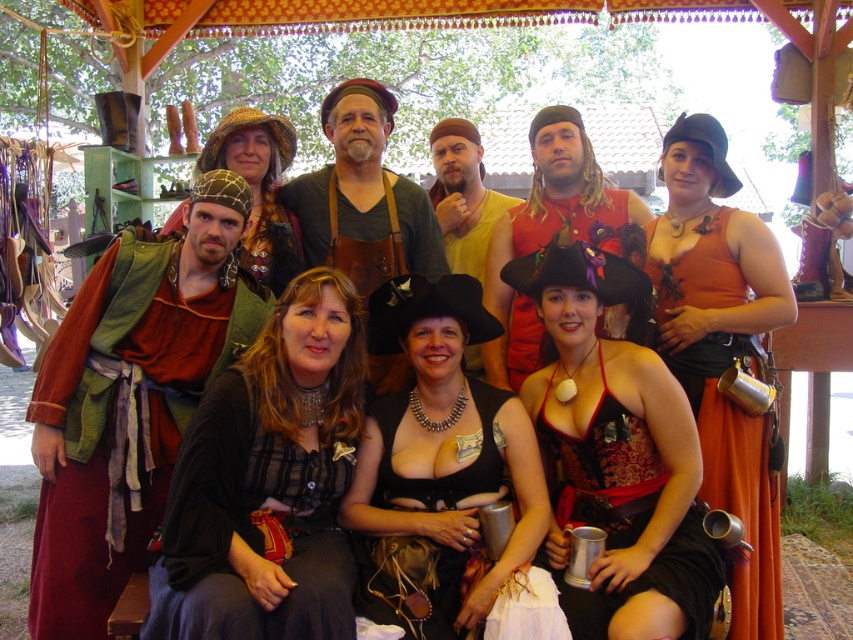
Question: Which of the following is the farthest from the observer?

Choices:
 (A) (90, 304)
 (B) (172, 556)

Answer: (A)

Question: Does matte black corset at center have a greater width compared to yellow cotton tunic at center?

Choices:
 (A) no
 (B) yes

Answer: (B)

Question: Estimate the real-world distances between objects in this image. Which object is closer to the matte brown hat at center?

Choices:
 (A) yellow cotton tunic at center
 (B) black sheer blouse at center

Answer: (A)

Question: Can you confirm if matte red tunic at left is positioned to the left of black leather vest at center?

Choices:
 (A) yes
 (B) no

Answer: (A)

Question: Can you confirm if black sheer blouse at center is thinner than matte red vest at center?

Choices:
 (A) yes
 (B) no

Answer: (A)

Question: Among these objects, which one is nearest to the camera?

Choices:
 (A) orange satin dress at center
 (B) yellow cotton tunic at center
 (C) black sheer blouse at center

Answer: (C)